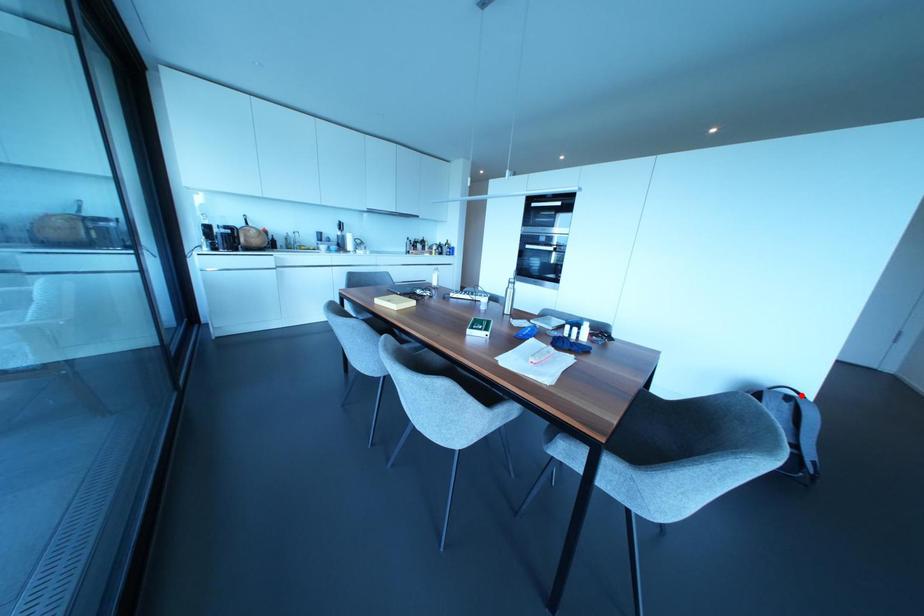
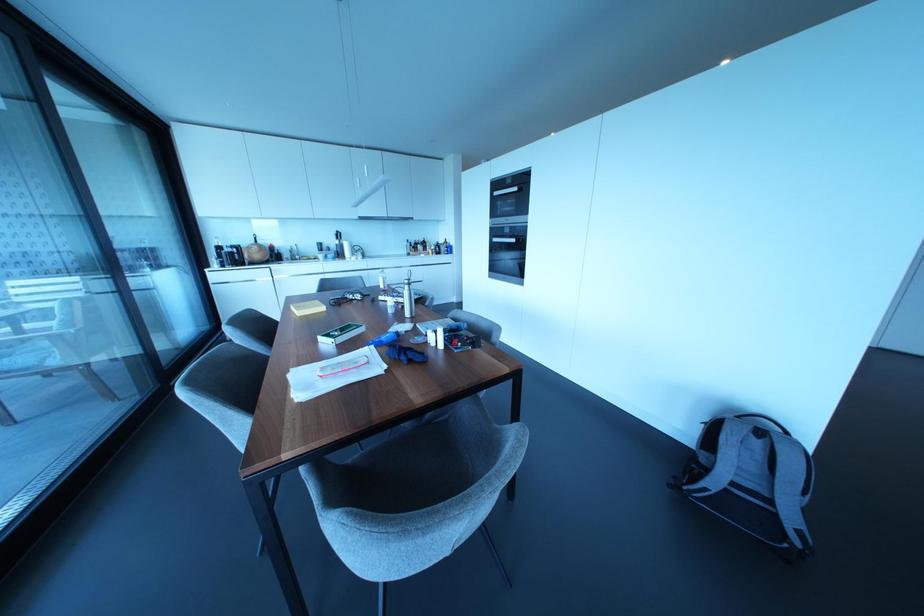
Locate, in the second image, the point that corresponds to the highlighted location in the first image.

(785, 431)